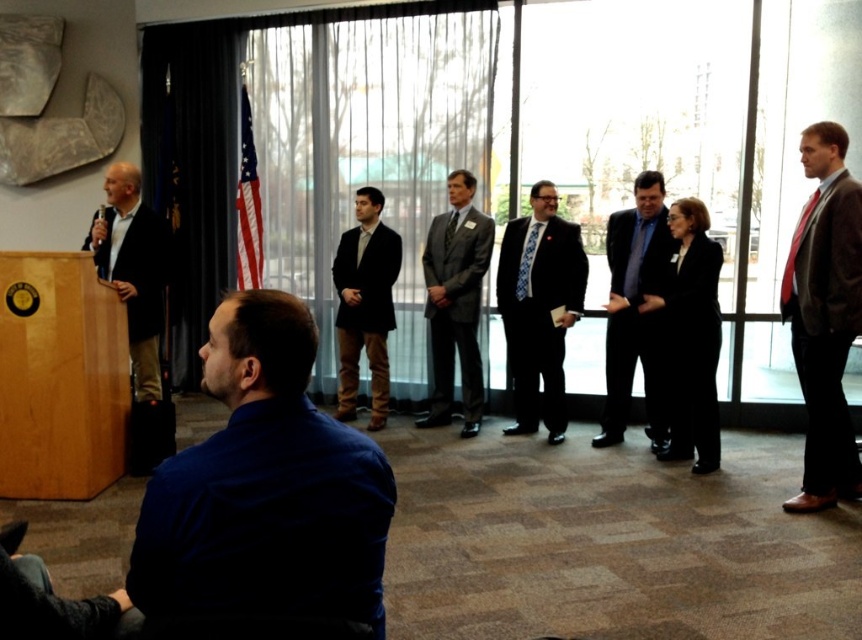
Question: Which of the following is the closest to the observer?

Choices:
 (A) pyautogui.click(x=832, y=221)
 (B) pyautogui.click(x=575, y=227)
 (C) pyautogui.click(x=460, y=204)

Answer: (A)

Question: Can you confirm if gray suit at center is positioned below dark brown suit at center?

Choices:
 (A) yes
 (B) no

Answer: (B)

Question: Which point is farther to the camera?

Choices:
 (A) [142, 328]
 (B) [467, 204]
 (C) [711, 330]

Answer: (B)

Question: Estimate the real-world distances between objects in this image. Which object is farther from the brown leather suit at right?

Choices:
 (A) dark gray wool suit at left
 (B) black matte suit at center
 (C) blue patterned tie at center
 (D) matte black suit at center

Answer: (A)

Question: From the image, what is the correct spatial relationship of dark blue shirt at lower left in relation to dark gray wool suit at left?

Choices:
 (A) left
 (B) right

Answer: (B)

Question: Is blue patterned tie at center further to camera compared to black matte suit at center?

Choices:
 (A) no
 (B) yes

Answer: (B)